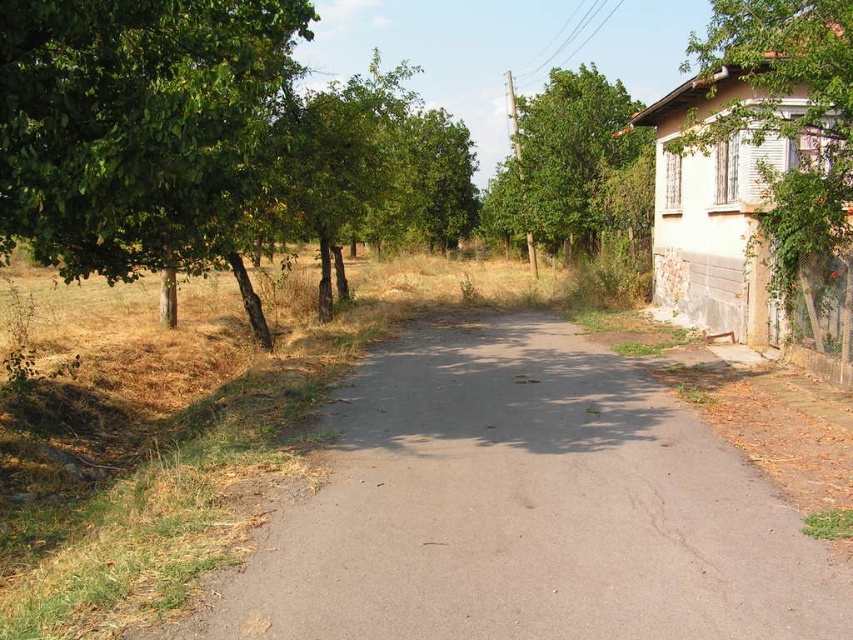
Looking at this image, who is lower down, white concrete house at right or green leafy tree at upper right?

Positioned lower is green leafy tree at upper right.

Is point (746, 289) farther from camera compared to point (544, 120)?

No, (746, 289) is closer to viewer.

The height and width of the screenshot is (640, 853). In order to click on white concrete house at right in this screenshot , I will do `click(759, 176)`.

Consider the image. Can you confirm if green leafy tree at left is smaller than green leafy tree at upper right?

Yes.

Is the position of green leafy tree at left less distant than that of green leafy tree at upper right?

Yes.

Locate an element on the screen. green leafy tree at left is located at coordinates (132, 124).

Is point (556, 563) positioned after point (144, 216)?

That is False.

Can you confirm if gray asphalt road at center is positioned above green leafy tree at left?

Actually, gray asphalt road at center is below green leafy tree at left.

What are the coordinates of `gray asphalt road at center` in the screenshot? It's located at (525, 509).